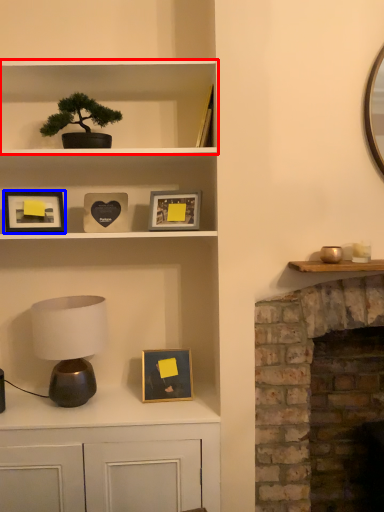
Question: Which object is further to the camera taking this photo, shelf (highlighted by a red box) or picture frame (highlighted by a blue box)?

Choices:
 (A) shelf
 (B) picture frame

Answer: (B)